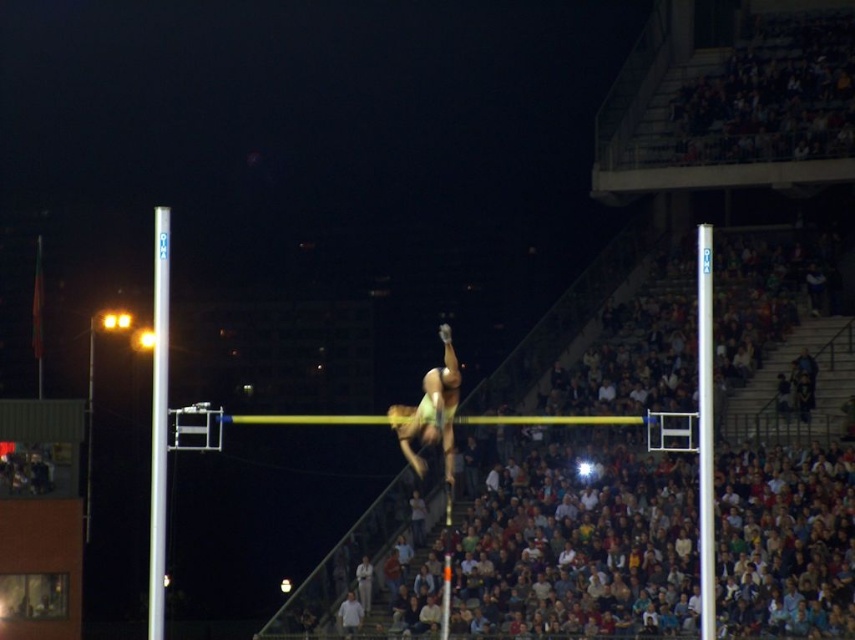
Question: Which point appears farthest from the camera in this image?

Choices:
 (A) (155, 548)
 (B) (697, 248)
 (C) (428, 435)

Answer: (B)

Question: Is silver metallic pole at left positioned behind green fabric athlete at center?

Choices:
 (A) yes
 (B) no

Answer: (A)

Question: Can you confirm if silver metallic pole at left is positioned above green fabric athlete at center?

Choices:
 (A) yes
 (B) no

Answer: (A)

Question: Can you confirm if silver metallic pole at center is positioned to the right of green fabric athlete at center?

Choices:
 (A) no
 (B) yes

Answer: (B)

Question: Which point is farther to the camera?

Choices:
 (A) silver metallic pole at left
 (B) green fabric athlete at center
 (C) silver metallic pole at center

Answer: (A)

Question: Which object appears farthest from the camera in this image?

Choices:
 (A) green fabric athlete at center
 (B) silver metallic pole at center
 (C) silver metallic pole at left

Answer: (C)